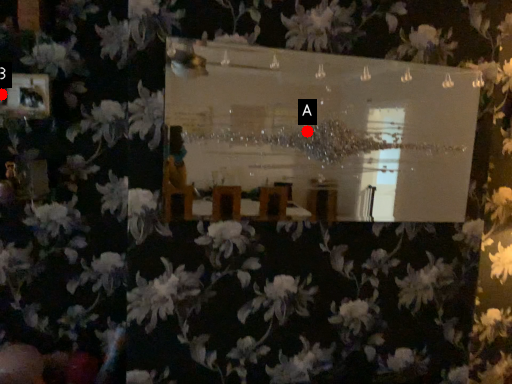
Question: Two points are circled on the image, labeled by A and B beside each circle. Which point appears farthest from the camera in this image?

Choices:
 (A) A is further
 (B) B is further

Answer: (B)